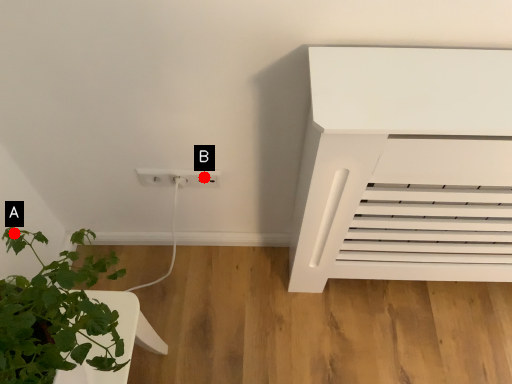
Question: Two points are circled on the image, labeled by A and B beside each circle. Which point appears closest to the camera in this image?

Choices:
 (A) A is closer
 (B) B is closer

Answer: (A)